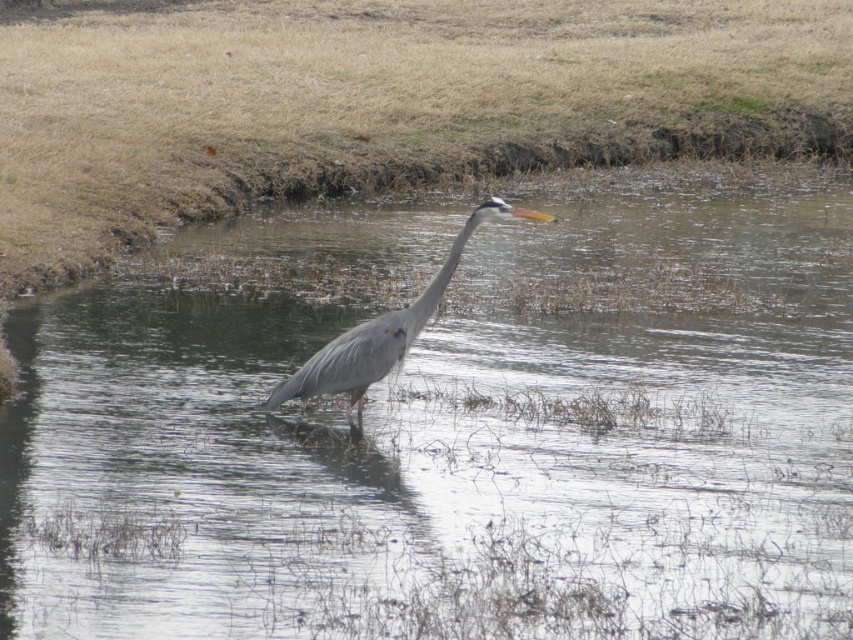
From the picture: You are a photographer trying to capture the gray matte heron at center in your shot. You notice the dry grass at upper center might block the view. Based on their widths, can the heron be fully visible without the grass overlapping it?

The dry grass at upper center might be wider than gray matte heron at center, so there is a possibility that the dry grass could overlap the heron in the photo, making it partially obscured.

You are a small frog trying to jump from the dry grass at upper center to the gray matte heron at center. Can you see the top of the heron from your current position?

The dry grass at upper center has a greater height compared to gray matte heron at center, so the frog cannot see the top of the gray matte heron at center because it is shorter than the dry grass at upper center.